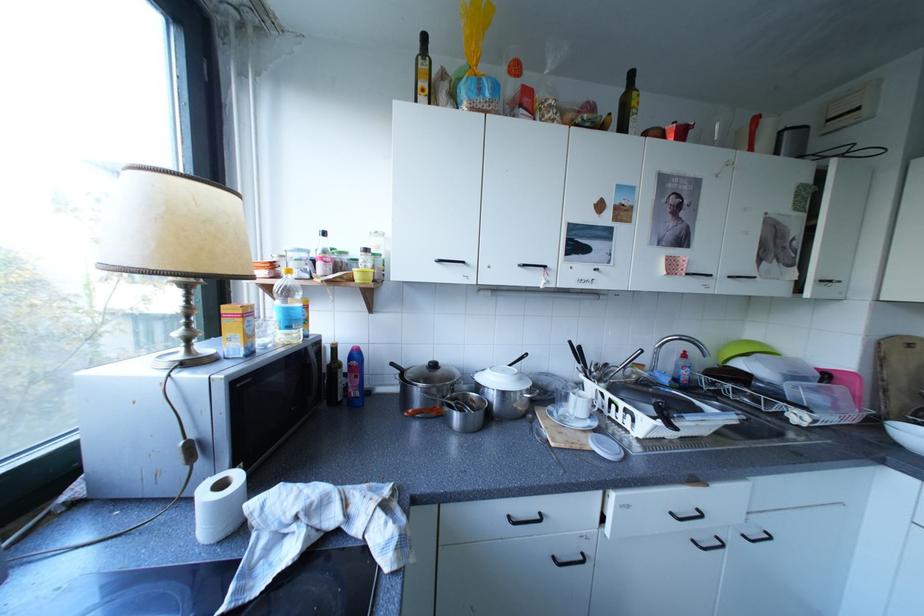
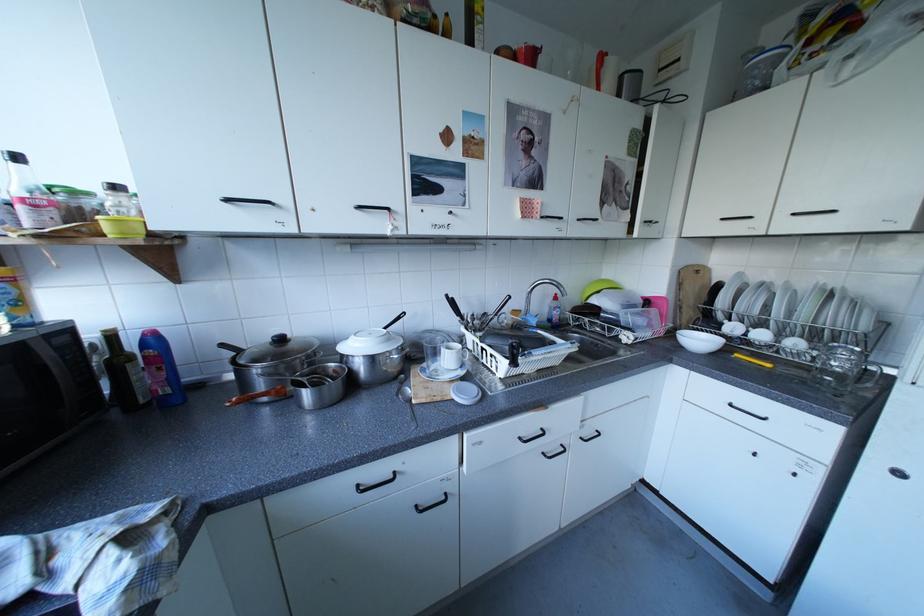
Find the pixel in the second image that matches [532,377] in the first image.

(400, 338)